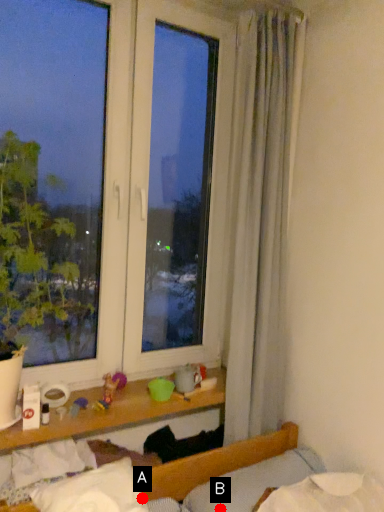
Question: Two points are circled on the image, labeled by A and B beside each circle. Which point is farther from the camera taking this photo?

Choices:
 (A) A is further
 (B) B is further

Answer: (A)